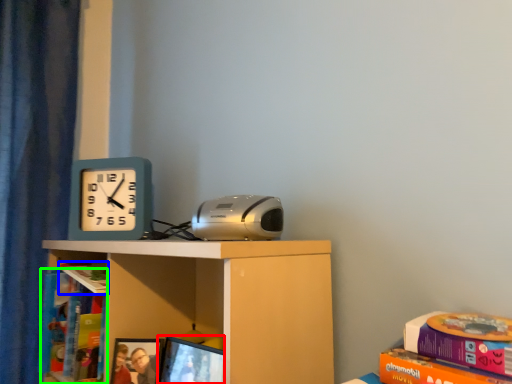
Question: Which is farther away from computer screen (highlighted by a red box)? book (highlighted by a blue box) or book (highlighted by a green box)?

Choices:
 (A) book
 (B) book

Answer: (B)